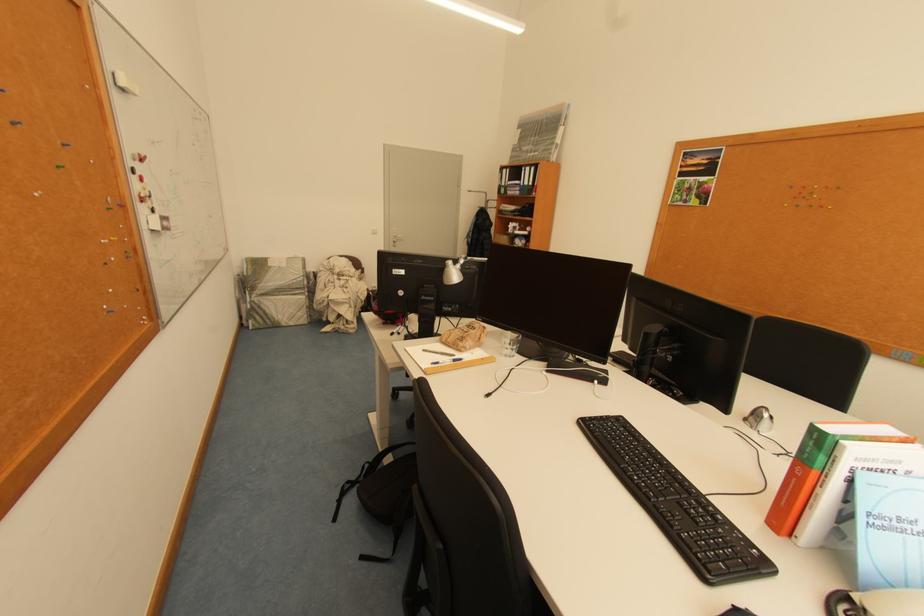
Image resolution: width=924 pixels, height=616 pixels. Find the location of `brown paper bag`. brown paper bag is located at coordinates point(465,336).